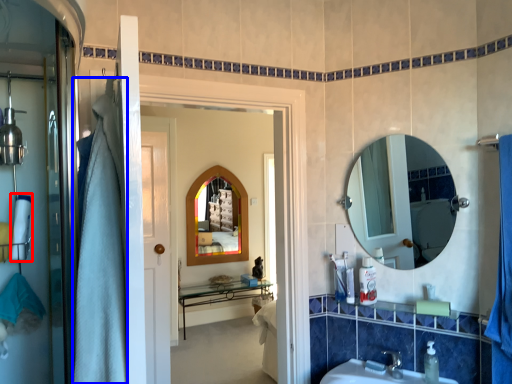
Question: Which object appears closest to the camera in this image, bath towel (highlighted by a red box) or shower curtain (highlighted by a blue box)?

Choices:
 (A) bath towel
 (B) shower curtain

Answer: (B)